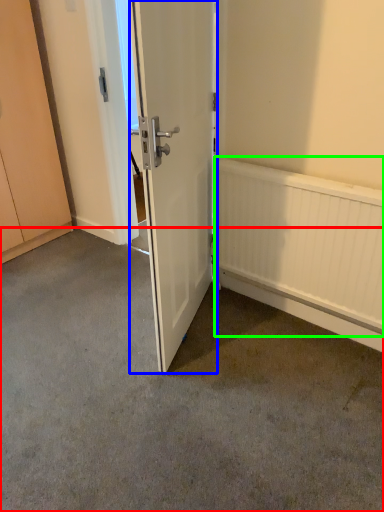
Question: Which is farther away from concrete (highlighted by a red box)? door (highlighted by a blue box) or radiator (highlighted by a green box)?

Choices:
 (A) door
 (B) radiator

Answer: (A)